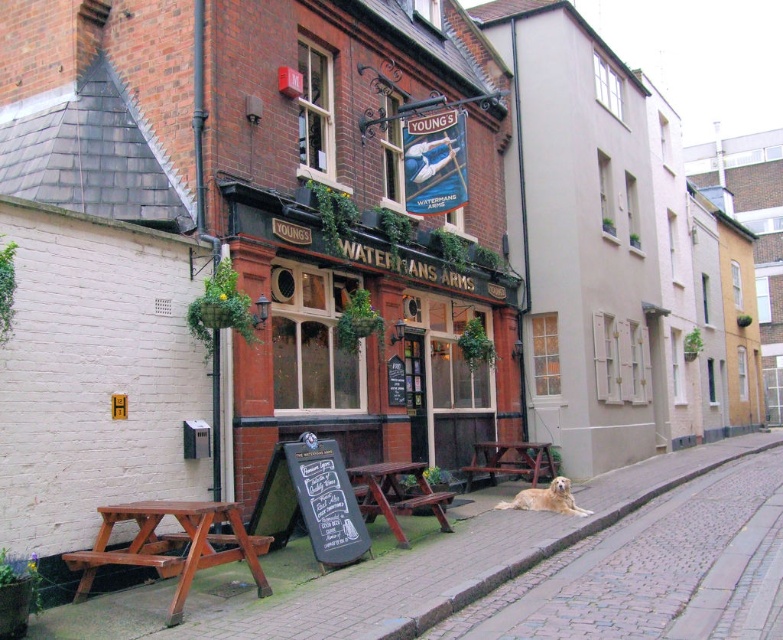
In the scene shown: You are standing at the entrance of Youngs Watermans Arms pub and want to reach a specific point marked at coordinates point (399, 604). If your walking speed is 3 feet per second, how many seconds will it take you to reach that point?

The distance between you and point (399, 604) is 21.06 feet. At a speed of 3 feet per second, it will take 21.06 divided by 3, which equals approximately 7.02 seconds to reach the point.